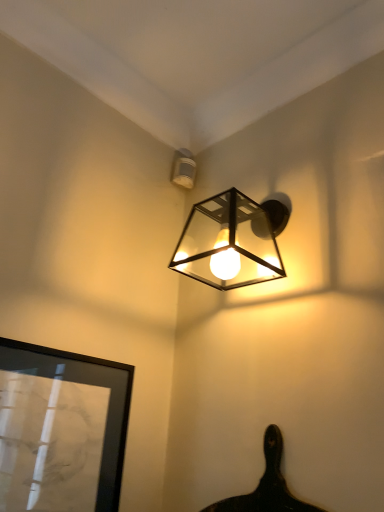
This screenshot has width=384, height=512. What are the coordinates of `metallic cube-shaped light fixture at upper center, marked as the first lamp in a bottom-to-top arrangement` in the screenshot? It's located at (228, 243).

How much space does metallic cube-shaped light fixture at upper center, marked as the first lamp in a bottom-to-top arrangement, occupy horizontally?

10.16 inches.

What is the approximate height of white plastic sensor at upper center, the 1th lamp when ordered from back to front?

The height of white plastic sensor at upper center, the 1th lamp when ordered from back to front, is 10.71 centimeters.

Find the location of a particular element. This screenshot has height=512, width=384. metallic cube-shaped light fixture at upper center, acting as the 1th lamp starting from the front is located at coordinates (228, 243).

From a real-world perspective, which is physically below, metallic cube-shaped light fixture at upper center, which is counted as the second lamp, starting from the top, or black glossy picture frame at lower left?

From a 3D spatial view, black glossy picture frame at lower left is below.

From the image's perspective, is metallic cube-shaped light fixture at upper center, the second lamp when ordered from back to front, located above black glossy picture frame at lower left?

Indeed, from the image's perspective, metallic cube-shaped light fixture at upper center, the second lamp when ordered from back to front, is shown above black glossy picture frame at lower left.

Considering the positions of objects metallic cube-shaped light fixture at upper center, acting as the 1th lamp starting from the front, and black glossy picture frame at lower left in the image provided, who is more to the right, metallic cube-shaped light fixture at upper center, acting as the 1th lamp starting from the front, or black glossy picture frame at lower left?

metallic cube-shaped light fixture at upper center, acting as the 1th lamp starting from the front.

Which is less distant, (222,259) or (17,377)?

The point (17,377) is in front.

Considering the relative sizes of black glossy picture frame at lower left and white plastic sensor at upper center, the 1th lamp when ordered from back to front, in the image provided, is black glossy picture frame at lower left wider than white plastic sensor at upper center, the 1th lamp when ordered from back to front,?

In fact, black glossy picture frame at lower left might be narrower than white plastic sensor at upper center, the 1th lamp when ordered from back to front.

Who is smaller, black glossy picture frame at lower left or white plastic sensor at upper center, the second lamp when ordered from bottom to top?

Smaller between the two is white plastic sensor at upper center, the second lamp when ordered from bottom to top.

Locate an element on the screen. picture frame below the white plastic sensor at upper center, which is the second lamp in front-to-back order (from the image's perspective) is located at coordinates (61, 429).

Is point (238, 221) positioned in front of point (192, 187)?

Yes.

From a real-world perspective, who is located higher, metallic cube-shaped light fixture at upper center, the second lamp when ordered from back to front, or white plastic sensor at upper center, the 1th lamp when ordered from back to front?

white plastic sensor at upper center, the 1th lamp when ordered from back to front, is physically above.

Considering the relative sizes of metallic cube-shaped light fixture at upper center, acting as the 1th lamp starting from the front, and white plastic sensor at upper center, which is the second lamp in front-to-back order, in the image provided, is metallic cube-shaped light fixture at upper center, acting as the 1th lamp starting from the front, thinner than white plastic sensor at upper center, which is the second lamp in front-to-back order,?

In fact, metallic cube-shaped light fixture at upper center, acting as the 1th lamp starting from the front, might be wider than white plastic sensor at upper center, which is the second lamp in front-to-back order.

From the image's perspective, is metallic cube-shaped light fixture at upper center, which is counted as the second lamp, starting from the top, above white plastic sensor at upper center, the 1th lamp when ordered from back to front?

No, from the image's perspective, metallic cube-shaped light fixture at upper center, which is counted as the second lamp, starting from the top, is not above white plastic sensor at upper center, the 1th lamp when ordered from back to front.

From the image's perspective, which object appears higher, white plastic sensor at upper center, the 1th lamp when ordered from back to front, or metallic cube-shaped light fixture at upper center, marked as the first lamp in a bottom-to-top arrangement?

white plastic sensor at upper center, the 1th lamp when ordered from back to front, appears higher in the image.

From a real-world perspective, is white plastic sensor at upper center, the 1th lamp when ordered from back to front, below metallic cube-shaped light fixture at upper center, the second lamp when ordered from back to front?

No.

From the picture: Is white plastic sensor at upper center, the second lamp when ordered from bottom to top, looking in the opposite direction of metallic cube-shaped light fixture at upper center, which is counted as the second lamp, starting from the top?

No, metallic cube-shaped light fixture at upper center, which is counted as the second lamp, starting from the top, is not at the back of white plastic sensor at upper center, the second lamp when ordered from bottom to top.

Can you see white plastic sensor at upper center, acting as the 1th lamp starting from the top, touching metallic cube-shaped light fixture at upper center, marked as the first lamp in a bottom-to-top arrangement?

No, white plastic sensor at upper center, acting as the 1th lamp starting from the top, is not beside metallic cube-shaped light fixture at upper center, marked as the first lamp in a bottom-to-top arrangement.

Is black glossy picture frame at lower left next to metallic cube-shaped light fixture at upper center, marked as the first lamp in a bottom-to-top arrangement, and touching it?

No, black glossy picture frame at lower left is not with metallic cube-shaped light fixture at upper center, marked as the first lamp in a bottom-to-top arrangement.

In the scene shown: From the image's perspective, is black glossy picture frame at lower left located beneath metallic cube-shaped light fixture at upper center, the second lamp when ordered from back to front?

Yes, from the image's perspective, black glossy picture frame at lower left is beneath metallic cube-shaped light fixture at upper center, the second lamp when ordered from back to front.

Can you confirm if black glossy picture frame at lower left is bigger than metallic cube-shaped light fixture at upper center, the second lamp when ordered from back to front?

Actually, black glossy picture frame at lower left might be smaller than metallic cube-shaped light fixture at upper center, the second lamp when ordered from back to front.

How distant is white plastic sensor at upper center, acting as the 1th lamp starting from the top, from black glossy picture frame at lower left?

white plastic sensor at upper center, acting as the 1th lamp starting from the top, and black glossy picture frame at lower left are 31.27 inches apart from each other.

Considering the sizes of objects white plastic sensor at upper center, the second lamp when ordered from bottom to top, and black glossy picture frame at lower left in the image provided, who is shorter, white plastic sensor at upper center, the second lamp when ordered from bottom to top, or black glossy picture frame at lower left?

white plastic sensor at upper center, the second lamp when ordered from bottom to top.

Is white plastic sensor at upper center, which is the second lamp in front-to-back order, thinner than black glossy picture frame at lower left?

No.

Does point (188, 162) come closer to viewer compared to point (36, 416)?

No, it is not.

You are a GUI agent. You are given a task and a screenshot of the screen. Output one action in this format:
    pyautogui.click(x=<x>, y=<y>)
    Task: Click on the 1st lamp above the black glossy picture frame at lower left (from the image's perspective)
    The width and height of the screenshot is (384, 512).
    Given the screenshot: What is the action you would take?
    pyautogui.click(x=228, y=243)

In the image, there is a white plastic sensor at upper center, acting as the 1th lamp starting from the top. Where is `picture frame below it (from a real-world perspective)`? picture frame below it (from a real-world perspective) is located at coordinates (61, 429).

Considering their positions, is white plastic sensor at upper center, the second lamp when ordered from bottom to top, positioned further to metallic cube-shaped light fixture at upper center, the second lamp when ordered from back to front, than black glossy picture frame at lower left?

Among the two, black glossy picture frame at lower left is located further to metallic cube-shaped light fixture at upper center, the second lamp when ordered from back to front.

Based on their spatial positions, is metallic cube-shaped light fixture at upper center, which is counted as the second lamp, starting from the top, or black glossy picture frame at lower left further from white plastic sensor at upper center, the second lamp when ordered from bottom to top?

black glossy picture frame at lower left.

Based on the photo, from the image, which object appears to be nearer to black glossy picture frame at lower left, metallic cube-shaped light fixture at upper center, marked as the first lamp in a bottom-to-top arrangement, or white plastic sensor at upper center, acting as the 1th lamp starting from the top?

metallic cube-shaped light fixture at upper center, marked as the first lamp in a bottom-to-top arrangement, is positioned closer to the anchor black glossy picture frame at lower left.

Considering their positions, is black glossy picture frame at lower left positioned closer to metallic cube-shaped light fixture at upper center, acting as the 1th lamp starting from the front, than white plastic sensor at upper center, the second lamp when ordered from bottom to top?

white plastic sensor at upper center, the second lamp when ordered from bottom to top.

Looking at the image, which one is located further to white plastic sensor at upper center, the 1th lamp when ordered from back to front, black glossy picture frame at lower left or metallic cube-shaped light fixture at upper center, which is counted as the second lamp, starting from the top?

black glossy picture frame at lower left lies further to white plastic sensor at upper center, the 1th lamp when ordered from back to front, than the other object.

Considering their positions, is white plastic sensor at upper center, acting as the 1th lamp starting from the top, positioned closer to black glossy picture frame at lower left than metallic cube-shaped light fixture at upper center, marked as the first lamp in a bottom-to-top arrangement?

metallic cube-shaped light fixture at upper center, marked as the first lamp in a bottom-to-top arrangement, lies closer to black glossy picture frame at lower left than the other object.

Locate an element on the screen. Image resolution: width=384 pixels, height=512 pixels. lamp between black glossy picture frame at lower left and white plastic sensor at upper center, which is the second lamp in front-to-back order, along the z-axis is located at coordinates (228, 243).